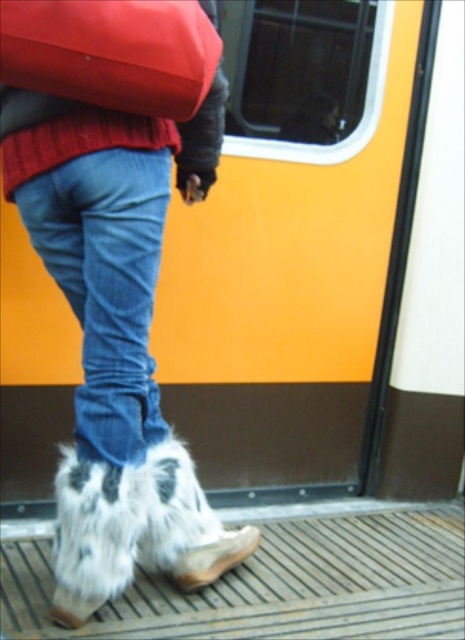
Between blue denim jeans at center and matte red backpack at upper left, which one appears on the right side from the viewer's perspective?

matte red backpack at upper left

Can you confirm if blue denim jeans at center is positioned to the right of matte red backpack at upper left?

No, blue denim jeans at center is not to the right of matte red backpack at upper left.

Does point (159, 168) come in front of point (27, 19)?

No, it is behind (27, 19).

You are a GUI agent. You are given a task and a screenshot of the screen. Output one action in this format:
    pyautogui.click(x=<x>, y=<y>)
    Task: Click on the blue denim jeans at center
    
    Given the screenshot: What is the action you would take?
    pyautogui.click(x=106, y=284)

Can you confirm if blue denim jeans at center is positioned to the right of brown suede boot at lower center?

No, blue denim jeans at center is not to the right of brown suede boot at lower center.

Measure the distance between blue denim jeans at center and camera.

They are 37.57 inches apart.

Find the location of a particular element. blue denim jeans at center is located at coordinates (106, 284).

This screenshot has width=465, height=640. What are the coordinates of `blue denim jeans at center` in the screenshot? It's located at (106, 284).

Is matte red backpack at upper left behind brown suede boot at lower center?

No, it is not.

How distant is matte red backpack at upper left from brown suede boot at lower center?

The distance of matte red backpack at upper left from brown suede boot at lower center is 35.91 inches.

Who is more distant from viewer, (x=99, y=12) or (x=226, y=540)?

The point (x=226, y=540) is more distant.

I want to click on matte red backpack at upper left, so (x=112, y=52).